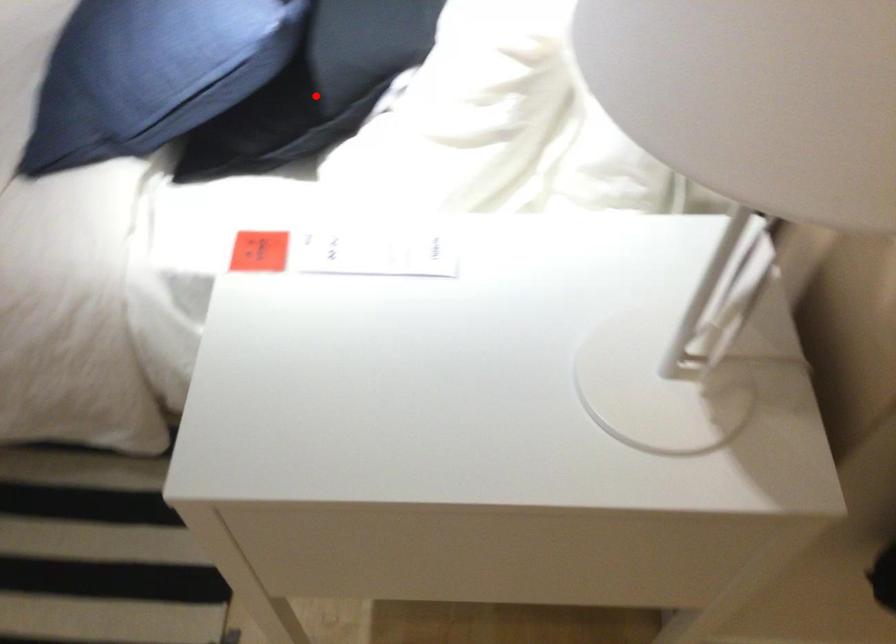
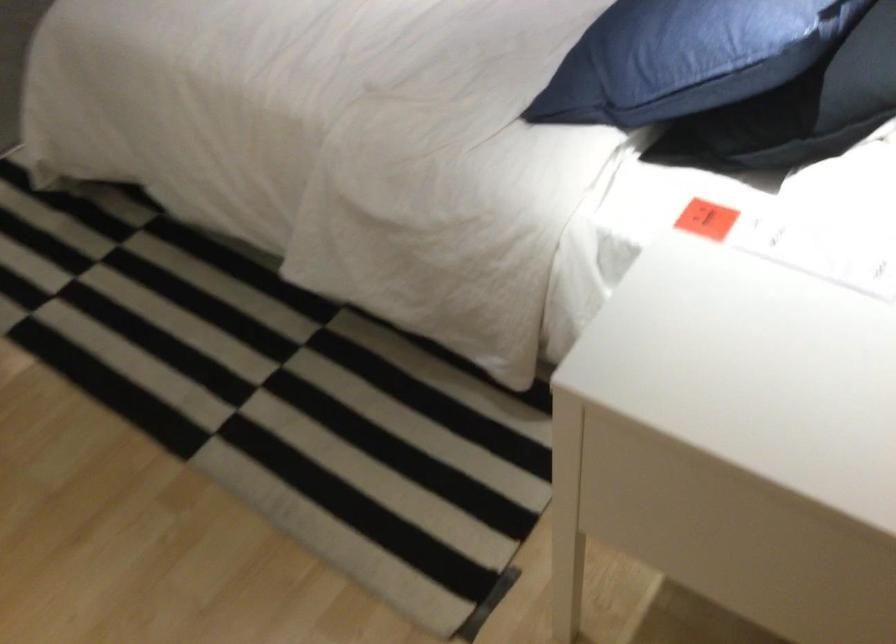
In the second image, find the point that corresponds to the highlighted location in the first image.

(808, 108)